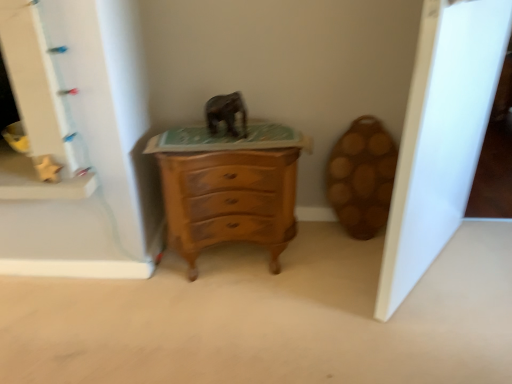
Where is `free area below wooden chest of drawers at center (from a real-world perspective)`? Image resolution: width=512 pixels, height=384 pixels. free area below wooden chest of drawers at center (from a real-world perspective) is located at coordinates (233, 255).